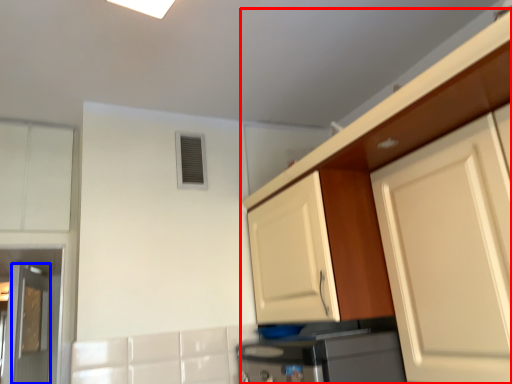
Question: Which object is closer to the camera taking this photo, cabinetry (highlighted by a red box) or door (highlighted by a blue box)?

Choices:
 (A) cabinetry
 (B) door

Answer: (A)